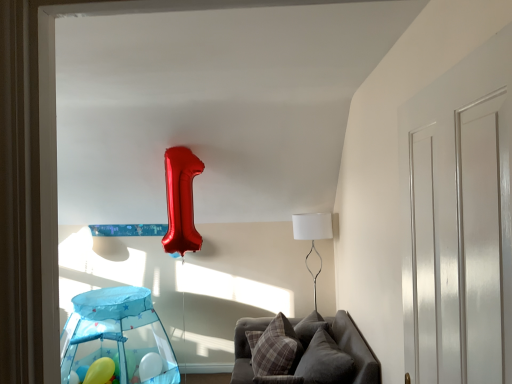
Question: Does plaid fabric pillow at lower center, positioned as the 1th pillow in left-to-right order, turn towards velvet gray couch at lower center?

Choices:
 (A) no
 (B) yes

Answer: (B)

Question: Considering the relative positions of plaid fabric pillow at lower center, which is the 2th pillow from right to left, and velvet gray couch at lower center in the image provided, is plaid fabric pillow at lower center, which is the 2th pillow from right to left, to the left of velvet gray couch at lower center from the viewer's perspective?

Choices:
 (A) no
 (B) yes

Answer: (B)

Question: Is plaid fabric pillow at lower center, which is the 2th pillow from right to left, not inside velvet gray couch at lower center?

Choices:
 (A) no
 (B) yes

Answer: (A)

Question: Is plaid fabric pillow at lower center, positioned as the 1th pillow in left-to-right order, smaller than velvet gray couch at lower center?

Choices:
 (A) no
 (B) yes

Answer: (B)

Question: Can you confirm if plaid fabric pillow at lower center, positioned as the 1th pillow in left-to-right order, is thinner than velvet gray couch at lower center?

Choices:
 (A) no
 (B) yes

Answer: (B)

Question: From the image's perspective, is velvet gray couch at lower center above or below white fabric lampshade at right?

Choices:
 (A) above
 (B) below

Answer: (B)

Question: Considering the positions of point (352, 331) and point (312, 274), is point (352, 331) closer or farther from the camera than point (312, 274)?

Choices:
 (A) farther
 (B) closer

Answer: (B)

Question: From a real-world perspective, relative to white fabric lampshade at right, is velvet gray couch at lower center vertically above or below?

Choices:
 (A) below
 (B) above

Answer: (A)

Question: In terms of height, does velvet gray couch at lower center look taller or shorter compared to white fabric lampshade at right?

Choices:
 (A) short
 (B) tall

Answer: (A)

Question: In terms of height, does plaid fabric pillow at lower center, positioned as the 1th pillow in left-to-right order, look taller or shorter compared to white fabric lampshade at right?

Choices:
 (A) tall
 (B) short

Answer: (B)

Question: Is point (294, 342) closer or farther from the camera than point (305, 258)?

Choices:
 (A) closer
 (B) farther

Answer: (A)

Question: Looking at their shapes, would you say plaid fabric pillow at lower center, positioned as the 1th pillow in left-to-right order, is wider or thinner than white fabric lampshade at right?

Choices:
 (A) thin
 (B) wide

Answer: (A)

Question: From the image's perspective, is plaid fabric pillow at lower center, positioned as the 1th pillow in left-to-right order, located above or below white fabric lampshade at right?

Choices:
 (A) above
 (B) below

Answer: (B)

Question: Is transparent plastic play tent at lower left in front of or behind white glossy door at right in the image?

Choices:
 (A) behind
 (B) front

Answer: (A)

Question: From a real-world perspective, is transparent plastic play tent at lower left above or below white glossy door at right?

Choices:
 (A) below
 (B) above

Answer: (A)